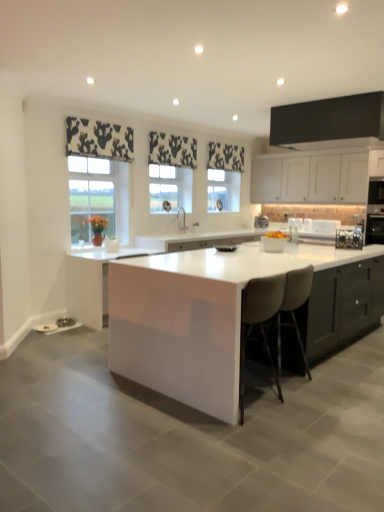
Question: Based on their sizes in the image, would you say clear glass window at center, which is counted as the second window, starting from the back, is bigger or smaller than white glossy table at center?

Choices:
 (A) big
 (B) small

Answer: (B)

Question: Considering the positions of point (185, 179) and point (203, 260), is point (185, 179) closer or farther from the camera than point (203, 260)?

Choices:
 (A) closer
 (B) farther

Answer: (B)

Question: Which object is the closest to the black stainless steel oven at right, placed as the first appliance when sorted from right to left?

Choices:
 (A) beige fabric stool at center
 (B) white glossy sink at center
 (C) white matte cabinet at upper right, which appears as the third cabinetry when viewed from the left
 (D) black and white fabric at upper left, positioned as the first curtain in left-to-right order
 (E) clear glass window at center, the first window positioned from the right

Answer: (C)

Question: Which is farther from the white matte cabinet at upper right, marked as the second cabinetry in a top-to-bottom arrangement?

Choices:
 (A) black stainless steel oven at right, placed as the first appliance when sorted from right to left
 (B) black matte cabinet at upper center, which appears as the 1th cabinetry when viewed from the top
 (C) white glossy bowl at center
 (D) white glossy sink at center
 (E) black glossy pan at center, the first appliance positioned from the left

Answer: (E)